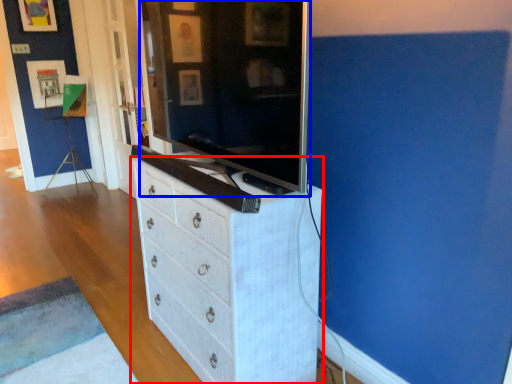
Question: Among these objects, which one is farthest to the camera, chest of drawers (highlighted by a red box) or television (highlighted by a blue box)?

Choices:
 (A) chest of drawers
 (B) television

Answer: (A)